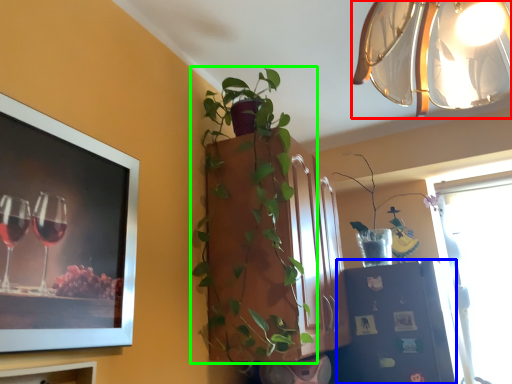
Question: Estimate the real-world distances between objects in this image. Which object is farther from lamp (highlighted by a red box), shelf (highlighted by a blue box) or houseplant (highlighted by a green box)?

Choices:
 (A) shelf
 (B) houseplant

Answer: (A)